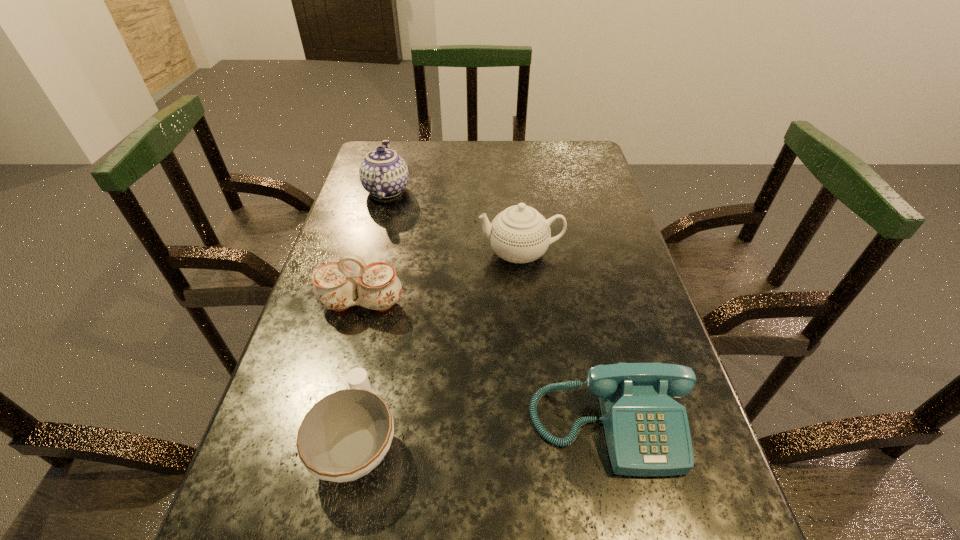
This screenshot has width=960, height=540. In order to click on vacant area between the farthest object and the rightmost chinaware in this screenshot , I will do `click(454, 222)`.

Where is `free spot between the telephone and the farthest object`? The image size is (960, 540). free spot between the telephone and the farthest object is located at coordinates (498, 307).

You are a GUI agent. You are given a task and a screenshot of the screen. Output one action in this format:
    pyautogui.click(x=<x>, y=<y>)
    Task: Click on the object that is the closest one to the fourth tallest object
    
    Given the screenshot: What is the action you would take?
    pyautogui.click(x=344, y=436)

This screenshot has width=960, height=540. Identify the location of object that is the third closest to the second farthest chinaware. (647, 432).

Locate which chinaware is the second closest to the shortest object. Please provide its 2D coordinates. Your answer should be formatted as a tuple, i.e. [(x, y)], where the tuple contains the x and y coordinates of a point satisfying the conditions above.

[(520, 234)]

Select which chinaware is the third closest to the second nearest chinaware. Please provide its 2D coordinates. Your answer should be formatted as a tuple, i.e. [(x, y)], where the tuple contains the x and y coordinates of a point satisfying the conditions above.

[(383, 173)]

Find the location of a particular element. The image size is (960, 540). free location that satisfies the following two spatial constraints: 1. on the spout of the fourth nearest object; 2. by the handle of the third farthest object is located at coordinates (526, 304).

Identify the location of free space in the image that satisfies the following two spatial constraints: 1. on the spout of the rightmost chinaware; 2. by the handle of the third farthest object. Image resolution: width=960 pixels, height=540 pixels. (526, 304).